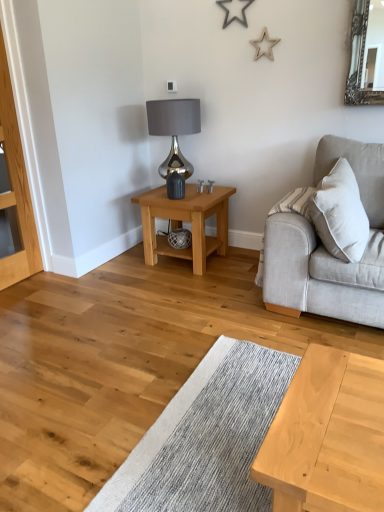
Question: Could light brown wooden table at center be considered to be inside light oak dresser at left?

Choices:
 (A) yes
 (B) no

Answer: (B)

Question: From the image's perspective, is light oak dresser at left under light brown wooden table at center?

Choices:
 (A) yes
 (B) no

Answer: (B)

Question: Does light oak dresser at left have a lesser height compared to light brown wooden table at center?

Choices:
 (A) yes
 (B) no

Answer: (B)

Question: From the image's perspective, is light oak dresser at left on top of light brown wooden table at center?

Choices:
 (A) no
 (B) yes

Answer: (B)

Question: Is light oak dresser at left thinner than light brown wooden table at center?

Choices:
 (A) no
 (B) yes

Answer: (B)

Question: Considering the positions of light oak dresser at left and satin silver lamp at upper center in the image, is light oak dresser at left wider or thinner than satin silver lamp at upper center?

Choices:
 (A) thin
 (B) wide

Answer: (A)

Question: Which is correct: light oak dresser at left is inside satin silver lamp at upper center, or outside of it?

Choices:
 (A) outside
 (B) inside

Answer: (A)

Question: Does point pos(31,272) appear closer or farther from the camera than point pos(165,126)?

Choices:
 (A) closer
 (B) farther

Answer: (B)

Question: Is light oak dresser at left to the left or to the right of satin silver lamp at upper center in the image?

Choices:
 (A) left
 (B) right

Answer: (A)

Question: From their relative heights in the image, would you say light gray fabric couch at right is taller or shorter than light oak dresser at left?

Choices:
 (A) tall
 (B) short

Answer: (B)

Question: Is light gray fabric couch at right wider or thinner than light oak dresser at left?

Choices:
 (A) thin
 (B) wide

Answer: (B)

Question: Does point (350, 287) appear closer or farther from the camera than point (1, 27)?

Choices:
 (A) closer
 (B) farther

Answer: (A)

Question: From the image's perspective, is light gray fabric couch at right positioned above or below light oak dresser at left?

Choices:
 (A) below
 (B) above

Answer: (A)

Question: Is point (132, 201) positioned closer to the camera than point (160, 108)?

Choices:
 (A) farther
 (B) closer

Answer: (A)

Question: From a real-world perspective, is light brown wooden table at center above or below satin silver lamp at upper center?

Choices:
 (A) below
 (B) above

Answer: (A)